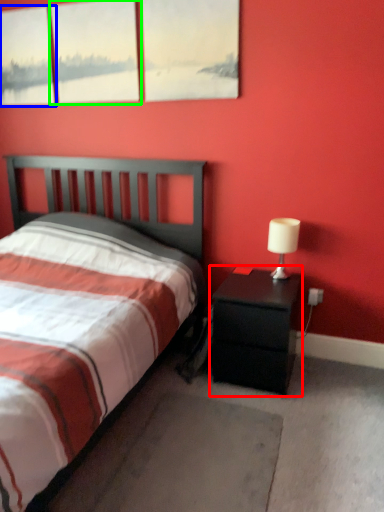
Question: Considering the real-world distances, which object is closest to nightstand (highlighted by a red box)? window (highlighted by a blue box) or window (highlighted by a green box).

Choices:
 (A) window
 (B) window

Answer: (B)